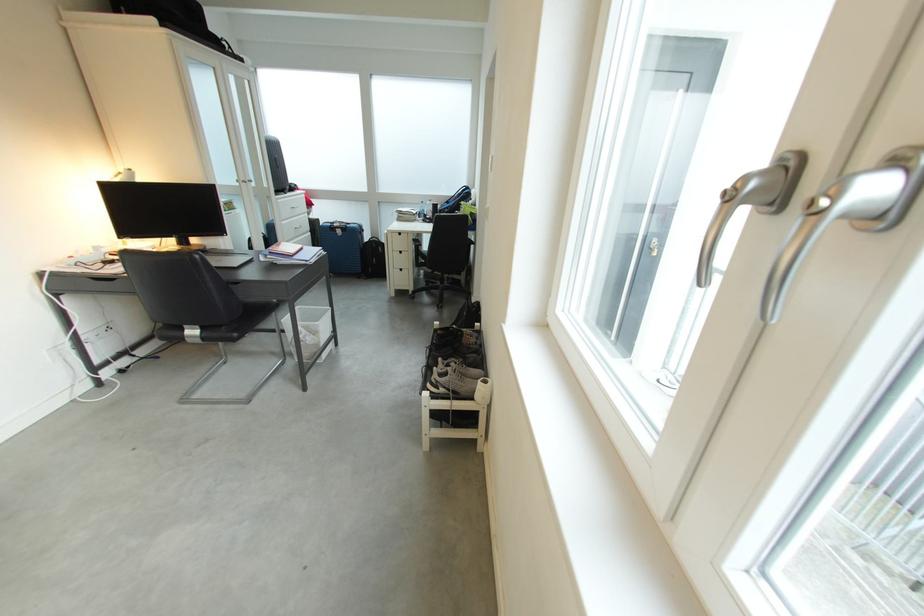
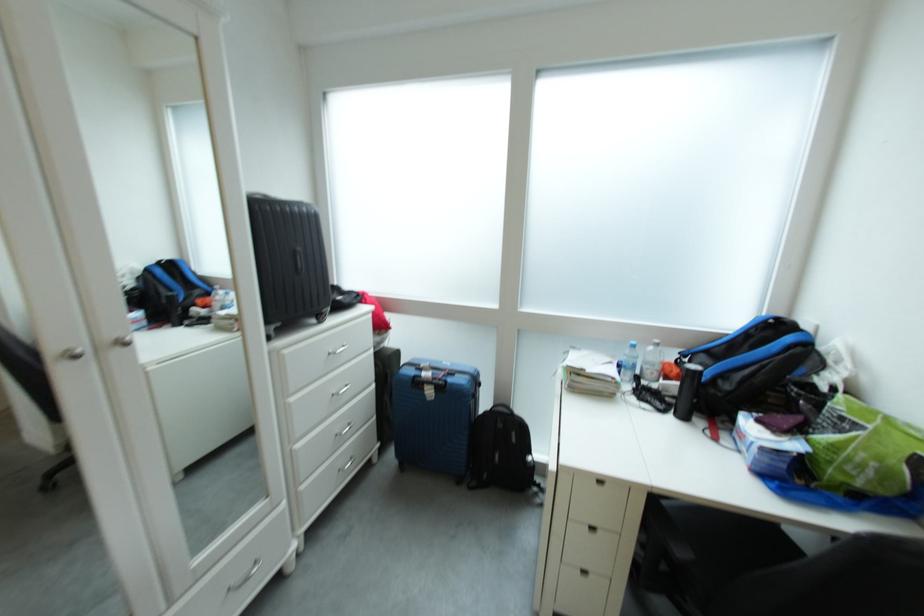
Where in the second image is the point corresponding to (457,213) from the first image?

(737, 390)